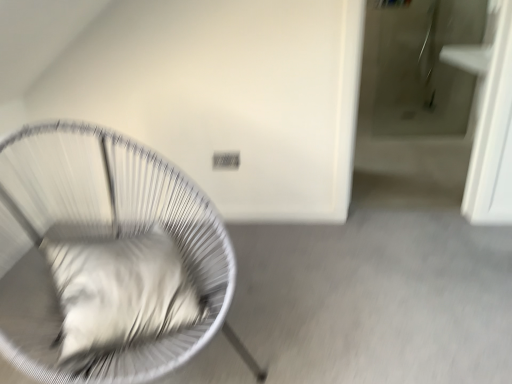
Find the location of a particular element. The height and width of the screenshot is (384, 512). white soft pillow at left is located at coordinates [120, 291].

Image resolution: width=512 pixels, height=384 pixels. Describe the element at coordinates (120, 291) in the screenshot. I see `white soft pillow at left` at that location.

In order to face white soft pillow at left, should I rotate leftwards or rightwards?

It's best to rotate left around 17.600 degrees.

What do you see at coordinates (101, 238) in the screenshot? The height and width of the screenshot is (384, 512). I see `white wire chair at left` at bounding box center [101, 238].

The width and height of the screenshot is (512, 384). Find the location of `white wire chair at left`. white wire chair at left is located at coordinates (101, 238).

This screenshot has width=512, height=384. I want to click on white soft pillow at left, so click(120, 291).

Considering the relative positions of white soft pillow at left and white wire chair at left in the image provided, is white soft pillow at left to the right of white wire chair at left from the viewer's perspective?

Correct, you'll find white soft pillow at left to the right of white wire chair at left.

Which is behind, white soft pillow at left or white wire chair at left?

white soft pillow at left is more distant.

Which is closer to the camera, (134, 252) or (39, 328)?

Point (134, 252) appears to be farther away from the viewer than point (39, 328).

From the image's perspective, which one is positioned higher, white soft pillow at left or white wire chair at left?

white wire chair at left.

From a real-world perspective, between white soft pillow at left and white wire chair at left, who is vertically higher?

In real-world perspective, white soft pillow at left is above.

Does white soft pillow at left have a lesser width compared to white wire chair at left?

Yes, white soft pillow at left is thinner than white wire chair at left.

Who is shorter, white soft pillow at left or white wire chair at left?

white soft pillow at left is shorter.

Does white soft pillow at left have a larger size compared to white wire chair at left?

No.

Is white soft pillow at left spatially inside white wire chair at left, or outside of it?

white soft pillow at left is enclosed within white wire chair at left.

Is white soft pillow at left next to white wire chair at left and touching it?

No, white soft pillow at left is not with white wire chair at left.

Is white wire chair at left at the back of white soft pillow at left?

Yes, white wire chair at left is at the back of white soft pillow at left.

How many degrees apart are the facing directions of white soft pillow at left and white wire chair at left?

There is a 22.3-degree angle between the facing directions of white soft pillow at left and white wire chair at left.

At what (x,y) coordinates should I click in order to perform the action: click on furniture in front of the white soft pillow at left. Please return your answer as a coordinate pair (x, y). Image resolution: width=512 pixels, height=384 pixels. Looking at the image, I should click on (101, 238).

Does white wire chair at left appear on the left side of white soft pillow at left?

Yes, white wire chair at left is to the left of white soft pillow at left.

Is white wire chair at left in front of or behind white soft pillow at left in the image?

Visually, white wire chair at left is located in front of white soft pillow at left.

Considering the positions of point (203, 222) and point (152, 333), is point (203, 222) closer or farther from the camera than point (152, 333)?

Point (203, 222) is farther from the camera than point (152, 333).

From the picture: From the image's perspective, which is above, white wire chair at left or white soft pillow at left?

From the image's view, white wire chair at left is above.

From a real-world perspective, is white wire chair at left over white soft pillow at left?

No, from a real-world perspective, white wire chair at left is not above white soft pillow at left.

Considering the sizes of white wire chair at left and white soft pillow at left in the image, is white wire chair at left wider or thinner than white soft pillow at left?

In the image, white wire chair at left appears to be wider than white soft pillow at left.

In terms of height, does white wire chair at left look taller or shorter compared to white soft pillow at left?

white wire chair at left is taller than white soft pillow at left.

Based on the photo, is white wire chair at left bigger than white soft pillow at left?

Yes, white wire chair at left is bigger than white soft pillow at left.

Is white wire chair at left not inside white soft pillow at left?

Yes, white wire chair at left is outside of white soft pillow at left.

Looking at this image, are white wire chair at left and white soft pillow at left located far from each other?

No, white wire chair at left is not far from white soft pillow at left.

Is white wire chair at left looking in the opposite direction of white soft pillow at left?

That's right, white wire chair at left is facing away from white soft pillow at left.

How distant is white wire chair at left from white soft pillow at left?

white wire chair at left and white soft pillow at left are 4.74 inches apart.

Where is `furniture that is under the white soft pillow at left (from a real-world perspective)`? Image resolution: width=512 pixels, height=384 pixels. furniture that is under the white soft pillow at left (from a real-world perspective) is located at coordinates (101, 238).

At what (x,y) coordinates should I click in order to perform the action: click on pillow behind the white wire chair at left. Please return your answer as a coordinate pair (x, y). Looking at the image, I should click on (120, 291).

Where is `furniture in front of the white soft pillow at left`? This screenshot has width=512, height=384. furniture in front of the white soft pillow at left is located at coordinates (101, 238).